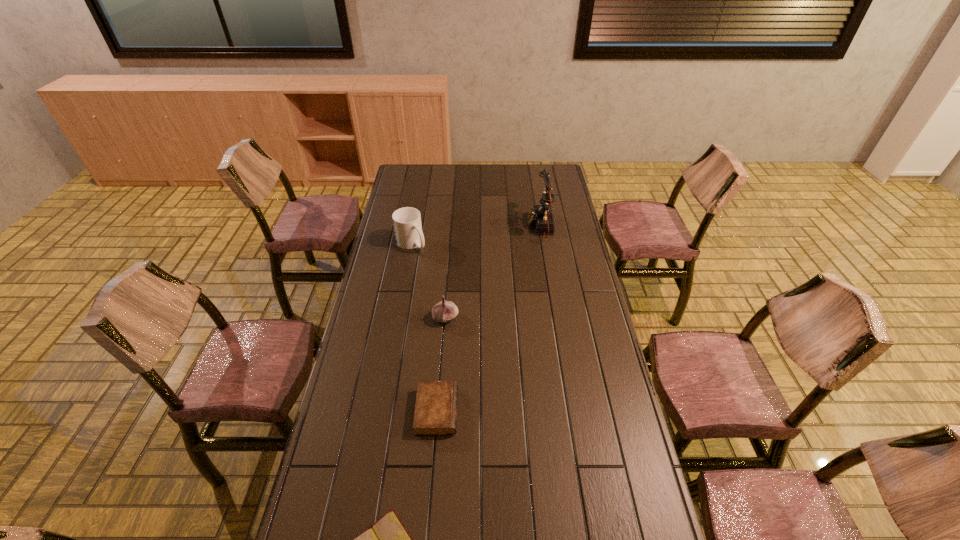
What are the coordinates of `free space located on the right of the mug` in the screenshot? It's located at (493, 244).

Identify the location of free space located on the back of the third nearest object. (448, 276).

You are a GUI agent. You are given a task and a screenshot of the screen. Output one action in this format:
    pyautogui.click(x=<x>, y=<y>)
    Task: Click on the free spot located on the spine side of the second nearest object
    The image size is (960, 540).
    Given the screenshot: What is the action you would take?
    pyautogui.click(x=473, y=411)

You are a GUI agent. You are given a task and a screenshot of the screen. Output one action in this format:
    pyautogui.click(x=<x>, y=<y>)
    Task: Click on the object positioned at the left edge
    
    Given the screenshot: What is the action you would take?
    [407, 221]

Identify the location of object present at the right edge. The image size is (960, 540). (541, 216).

In the image, there is a desktop. Where is `vacant space at the far edge`? This screenshot has width=960, height=540. vacant space at the far edge is located at coordinates (459, 179).

Identify the location of free space at the left edge of the desktop. 365,333.

Where is `free location at the right edge of the desktop`? The image size is (960, 540). free location at the right edge of the desktop is located at coordinates (589, 291).

Image resolution: width=960 pixels, height=540 pixels. I want to click on vacant space at the far left corner, so click(x=423, y=167).

Find the location of `free space at the far right corner`. free space at the far right corner is located at coordinates (560, 184).